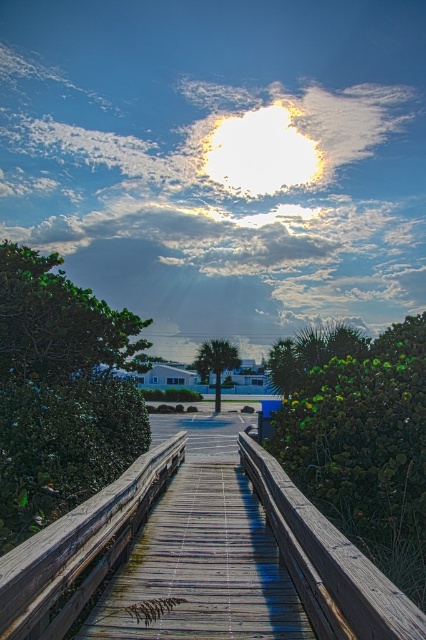
Question: Considering the relative positions of weathered wood rail at center and wooden at center in the image provided, where is weathered wood rail at center located with respect to wooden at center?

Choices:
 (A) below
 (B) above

Answer: (A)

Question: Observing the image, what is the correct spatial positioning of weathered wood boardwalk at center in reference to wooden at center?

Choices:
 (A) right
 (B) left

Answer: (B)

Question: Can you confirm if weathered wood boardwalk at center is bigger than weathered wood rail at center?

Choices:
 (A) no
 (B) yes

Answer: (B)

Question: Based on their relative distances, which object is nearer to the weathered wood rail at center?

Choices:
 (A) weathered wood boardwalk at center
 (B) wooden at center

Answer: (B)

Question: Which point appears closest to the camera in this image?

Choices:
 (A) (155, 636)
 (B) (54, 582)

Answer: (B)

Question: Which of the following is the farthest from the observer?

Choices:
 (A) (80, 570)
 (B) (342, 534)
 (C) (195, 627)

Answer: (B)